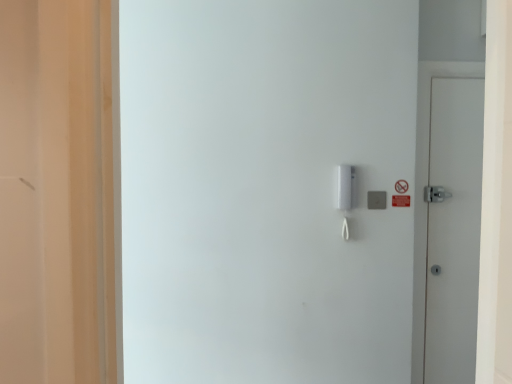
Locate an element on the screen. The image size is (512, 384). gray matte/light switch at center-right is located at coordinates (376, 200).

Measure the distance between point (338, 4) and camera.

6.77 feet.

The image size is (512, 384). I want to click on white plastic intercom at center-right, so click(266, 190).

Identify the location of white matte door at right. Image resolution: width=512 pixels, height=384 pixels. (453, 229).

Considering the positions of objects white matte door at right and white plastic intercom at center-right in the image provided, who is more to the right, white matte door at right or white plastic intercom at center-right?

From the viewer's perspective, white matte door at right appears more on the right side.

From the picture: Is white matte door at right facing towards white plastic intercom at center-right?

No, white matte door at right is not aimed at white plastic intercom at center-right.

Who is more distant, white matte door at right or white plastic intercom at center-right?

white matte door at right is behind.

Considering the relative sizes of white plastic intercom at center-right and white matte door at right in the image provided, is white plastic intercom at center-right shorter than white matte door at right?

Indeed, white plastic intercom at center-right has a lesser height compared to white matte door at right.

Is point (395, 146) more distant than point (461, 193)?

No, (395, 146) is in front of (461, 193).

Find the location of `door behind the white plastic intercom at center-right`. door behind the white plastic intercom at center-right is located at coordinates (453, 229).

Is white plastic intercom at center-right aimed at white matte door at right?

No.

Does gray matte/light switch at center-right touch white matte door at right?

gray matte/light switch at center-right is not next to white matte door at right, and they're not touching.

Which of these two, gray matte/light switch at center-right or white matte door at right, is smaller?

gray matte/light switch at center-right is smaller.

Is gray matte/light switch at center-right oriented away from white matte door at right?

No, gray matte/light switch at center-right is not facing away from white matte door at right.

Which of these two, gray matte/light switch at center-right or white matte door at right, is wider?

Wider between the two is white matte door at right.

Can we say gray matte/light switch at center-right lies outside white plastic intercom at center-right?

gray matte/light switch at center-right lies outside white plastic intercom at center-right's area.

Is gray matte/light switch at center-right to the right of white plastic intercom at center-right from the viewer's perspective?

Yes.

Can you confirm if gray matte/light switch at center-right is smaller than white plastic intercom at center-right?

Yes, gray matte/light switch at center-right is smaller than white plastic intercom at center-right.

Which object is positioned more to the right, white matte door at right or gray matte/light switch at center-right?

Positioned to the right is white matte door at right.

From the image's perspective, which object appears higher, white matte door at right or gray matte/light switch at center-right?

gray matte/light switch at center-right.

Is white matte door at right shorter than gray matte/light switch at center-right?

In fact, white matte door at right may be taller than gray matte/light switch at center-right.

From a real-world perspective, which object rests below the other?

In real-world perspective, gray matte/light switch at center-right is lower.

Can we say white plastic intercom at center-right lies outside gray matte/light switch at center-right?

Indeed, white plastic intercom at center-right is completely outside gray matte/light switch at center-right.

Which is more to the right, white plastic intercom at center-right or gray matte/light switch at center-right?

From the viewer's perspective, gray matte/light switch at center-right appears more on the right side.

The height and width of the screenshot is (384, 512). What are the coordinates of `door below the white plastic intercom at center-right (from the image's perspective)` in the screenshot? It's located at (453, 229).

The width and height of the screenshot is (512, 384). I want to click on screen door in front of the white matte door at right, so click(x=266, y=190).

Estimate the real-world distances between objects in this image. Which object is closer to white matte door at right, gray matte/light switch at center-right or white plastic intercom at center-right?

gray matte/light switch at center-right lies closer to white matte door at right than the other object.

In the scene shown: When comparing their distances from gray matte/light switch at center-right, does white matte door at right or white plastic intercom at center-right seem closer?

white matte door at right lies closer to gray matte/light switch at center-right than the other object.

From the image, which object appears to be nearer to white plastic intercom at center-right, white matte door at right or gray matte/light switch at center-right?

white matte door at right is closer to white plastic intercom at center-right.

Which object lies nearer to the anchor point white matte door at right, white plastic intercom at center-right or gray matte/light switch at center-right?

gray matte/light switch at center-right is positioned closer to the anchor white matte door at right.

Looking at the image, which one is located closer to gray matte/light switch at center-right, white plastic intercom at center-right or white matte door at right?

white matte door at right lies closer to gray matte/light switch at center-right than the other object.

When comparing their distances from white plastic intercom at center-right, does gray matte/light switch at center-right or white matte door at right seem closer?

white matte door at right is closer to white plastic intercom at center-right.

At what (x,y) coordinates should I click in order to perform the action: click on light switch between white plastic intercom at center-right and white matte door at right along the z-axis. Please return your answer as a coordinate pair (x, y). This screenshot has height=384, width=512. Looking at the image, I should click on (376, 200).